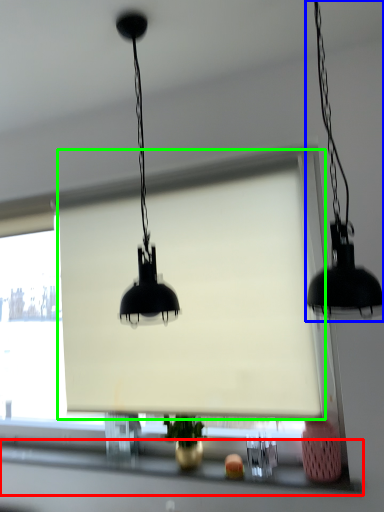
Question: Which is nearer to the window sill (highlighted by a red box)? lamp (highlighted by a blue box) or window screen (highlighted by a green box).

Choices:
 (A) lamp
 (B) window screen

Answer: (B)